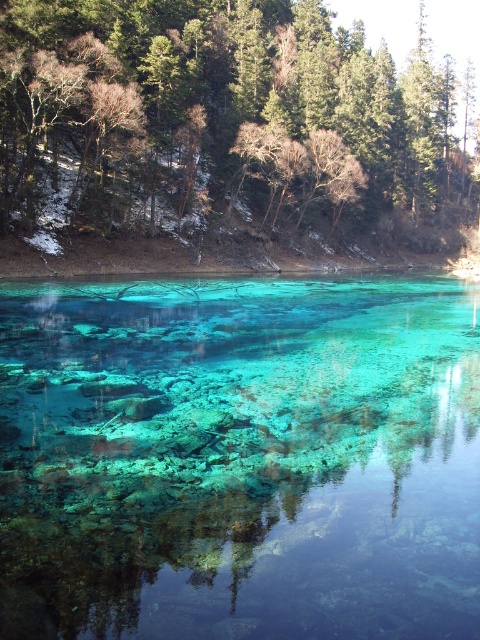
Can you confirm if translucent teal water at center is bigger than green leafy tree at upper center?

Incorrect, translucent teal water at center is not larger than green leafy tree at upper center.

Measure the distance from translucent teal water at center to green leafy tree at upper center.

translucent teal water at center is 56.34 meters from green leafy tree at upper center.

Does point (226, 403) lie in front of point (395, 141)?

Yes.

I want to click on translucent teal water at center, so click(x=240, y=458).